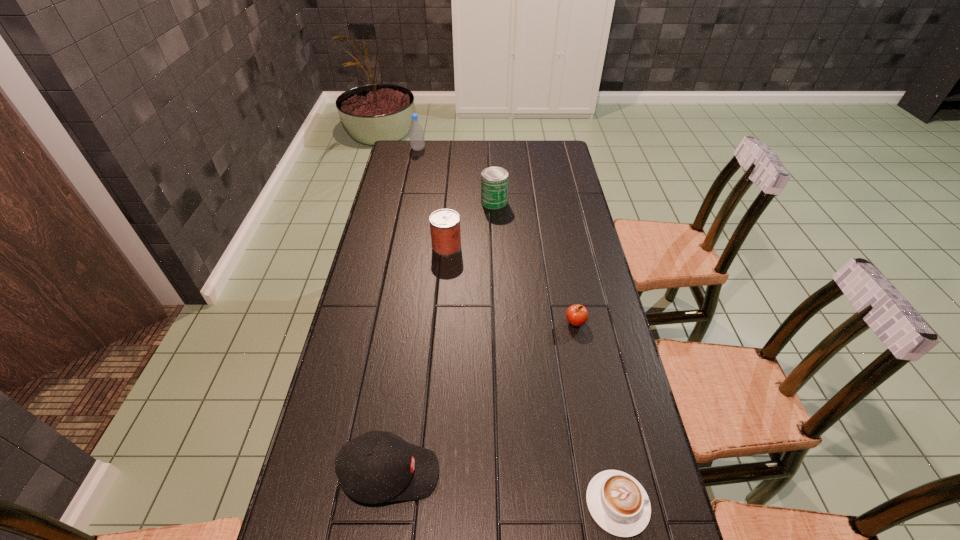
Find the location of `free space between the apple and the left can`. free space between the apple and the left can is located at coordinates (511, 284).

The height and width of the screenshot is (540, 960). I want to click on blank region between the nearer can and the apple, so click(x=511, y=284).

At what (x,y) coordinates should I click in order to perform the action: click on empty location between the nearer can and the farther can. Please return your answer as a coordinate pair (x, y). The image size is (960, 540). Looking at the image, I should click on (470, 224).

Identify the location of vacant space that's between the left can and the baseball cap. (419, 360).

Image resolution: width=960 pixels, height=540 pixels. I want to click on vacant space that's between the farther can and the tallest object, so click(x=456, y=176).

The width and height of the screenshot is (960, 540). What are the coordinates of `the second closest object relative to the fourth nearest object` in the screenshot? It's located at (577, 315).

Identify the location of object that stands as the second closest to the second shortest object. pyautogui.click(x=445, y=223).

Find the location of a particular element. Image resolution: width=960 pixels, height=540 pixels. vacant area in the image that satisfies the following two spatial constraints: 1. on the back side of the third farthest object; 2. on the left side of the farther can is located at coordinates (450, 201).

The width and height of the screenshot is (960, 540). I want to click on free spot that satisfies the following two spatial constraints: 1. on the front side of the fifth tallest object; 2. on the right side of the third object from right to left, so click(499, 322).

This screenshot has width=960, height=540. What are the coordinates of `free spot that satisfies the following two spatial constraints: 1. on the front side of the fifth tallest object; 2. with a logo on the front of the baseball cap` in the screenshot? It's located at (605, 474).